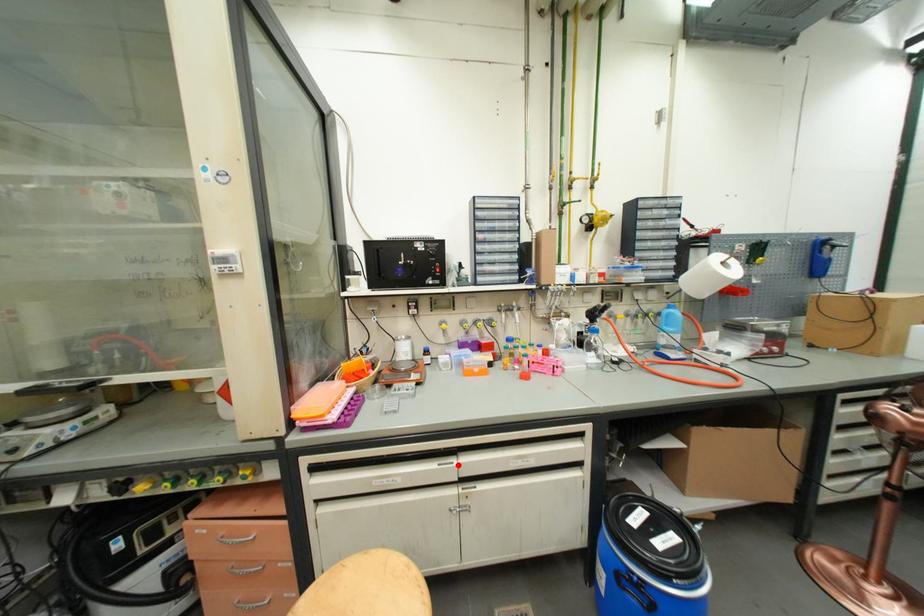
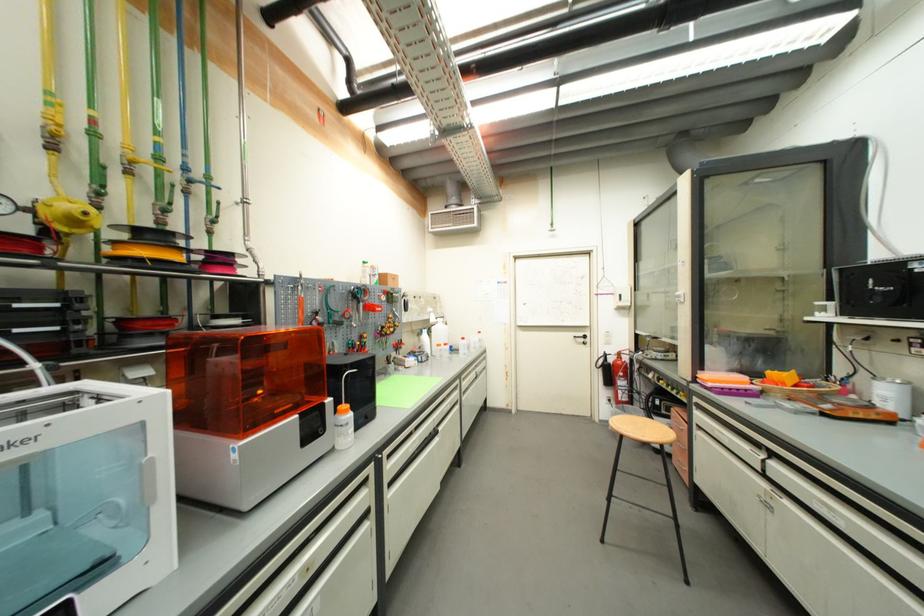
Question: I am providing you with two images of the same scene from different viewpoints. A red point is marked on the first image. Is the red point's position out of view in image 2?

Choices:
 (A) Yes
 (B) No

Answer: (B)